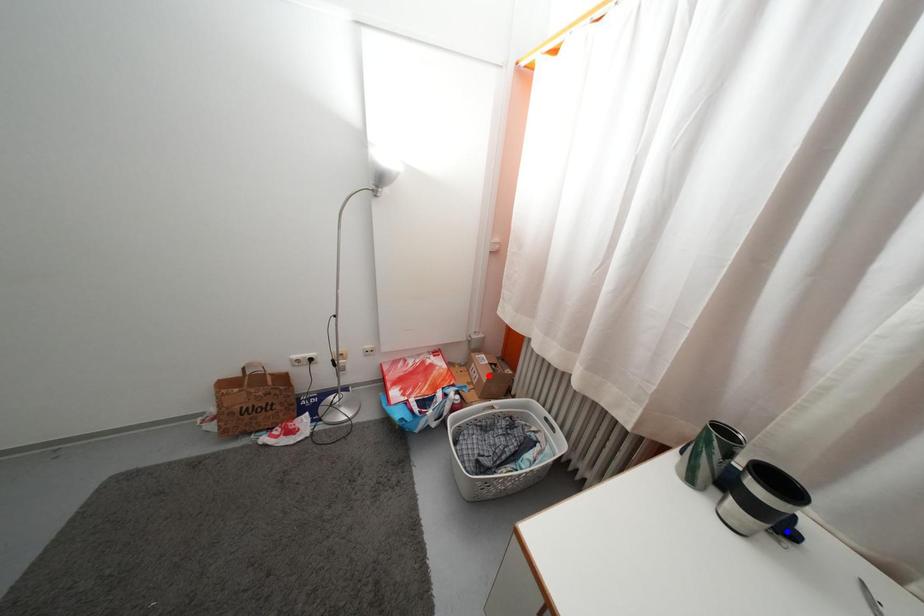
Question: In the image, two points are highlighted. Which point is nearer to the camera? Reply with the corresponding letter.

Choices:
 (A) blue point
 (B) red point

Answer: (A)